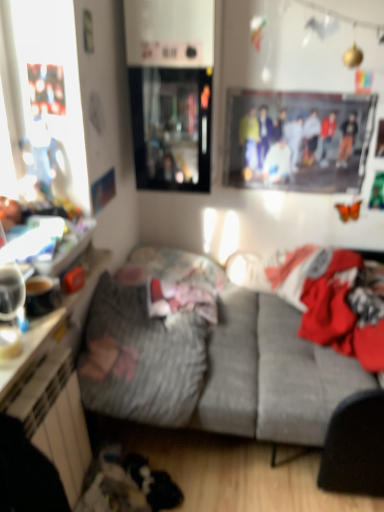
Question: Based on their sizes in the image, would you say fluffy gray blanket at center is bigger or smaller than gray fabric couch at center?

Choices:
 (A) small
 (B) big

Answer: (A)

Question: Is fluffy gray blanket at center spatially inside gray fabric couch at center, or outside of it?

Choices:
 (A) outside
 (B) inside

Answer: (B)

Question: Estimate the real-world distances between objects in this image. Which object is closer to the gray fabric couch at center?

Choices:
 (A) fluffy gray blanket at center
 (B) red fabric laundry at center
 (C) transparent glass cabinet at upper center
 (D) printed fabric poster at upper center
 (E) white glossy dresser at lower left

Answer: (A)

Question: Estimate the real-world distances between objects in this image. Which object is farther from the gray fabric couch at center?

Choices:
 (A) white glossy dresser at lower left
 (B) printed fabric poster at upper center
 (C) red fabric laundry at center
 (D) fluffy gray blanket at center
 (E) transparent glass cabinet at upper center

Answer: (B)